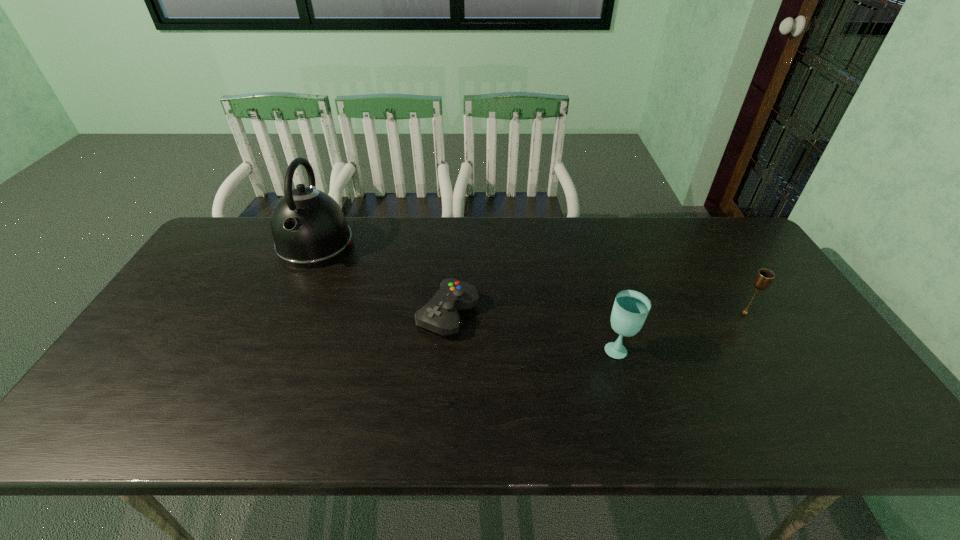
Identify the location of free region located 0.210m on the front of the second shortest object. Image resolution: width=960 pixels, height=540 pixels. (788, 383).

Where is `free space located 0.340m on the right of the control`? This screenshot has width=960, height=540. free space located 0.340m on the right of the control is located at coordinates (603, 314).

Identify the location of object that is at the far edge. (309, 229).

I want to click on object present at the right edge, so tap(764, 277).

This screenshot has width=960, height=540. Find the location of `vacant space at the far edge`. vacant space at the far edge is located at coordinates coord(481,228).

Locate an element on the screen. free space at the near edge of the desktop is located at coordinates (358, 436).

In the image, there is a desktop. Identify the location of vacant space at the far right corner. (739, 254).

Identify the location of vacant space that's between the kettle and the third object from right to left. (382, 280).

Find the location of a particular element. This screenshot has width=960, height=540. vacant space that is in between the chalice and the glass is located at coordinates (682, 330).

In order to click on empty space that is in between the leftmost object and the shortest object in this screenshot , I will do `click(382, 280)`.